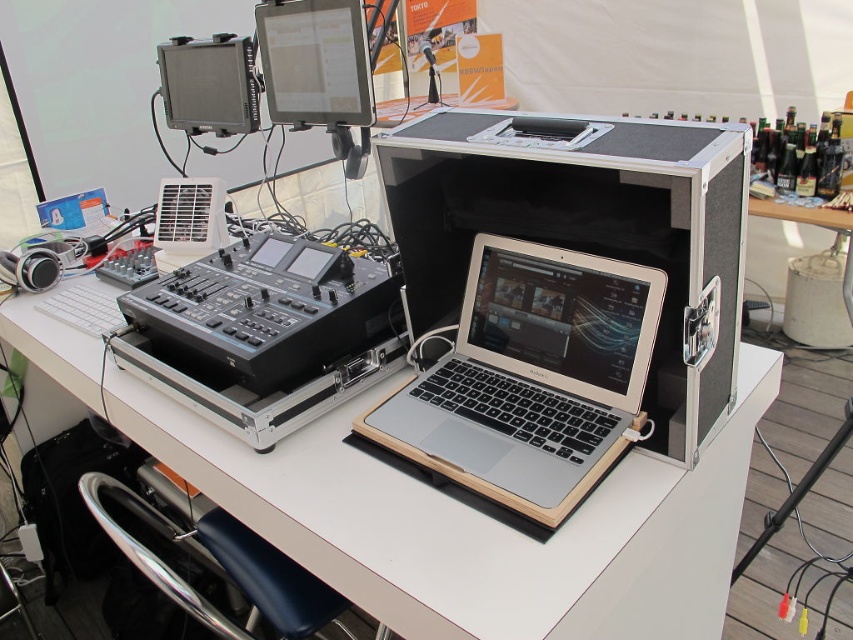
Question: Which object is farther from the camera taking this photo?

Choices:
 (A) black plastic audio mixer at center
 (B) silver metallic laptop at center
 (C) white matte computer desk at center
 (D) silver/black case at center

Answer: (A)

Question: From the image, what is the correct spatial relationship of silver/black case at center in relation to silver metallic laptop at center?

Choices:
 (A) above
 (B) below

Answer: (A)

Question: Which of these objects is positioned farthest from the black plastic audio mixer at center?

Choices:
 (A) silver/black case at center
 (B) white matte computer desk at center
 (C) silver metallic laptop at center

Answer: (A)

Question: Is silver/black case at center smaller than black plastic audio mixer at center?

Choices:
 (A) yes
 (B) no

Answer: (B)

Question: Which of the following is the closest to the observer?

Choices:
 (A) silver/black case at center
 (B) black plastic audio mixer at center
 (C) silver metallic laptop at center

Answer: (A)

Question: Is white matte computer desk at center to the right of black plastic audio mixer at center from the viewer's perspective?

Choices:
 (A) no
 (B) yes

Answer: (B)